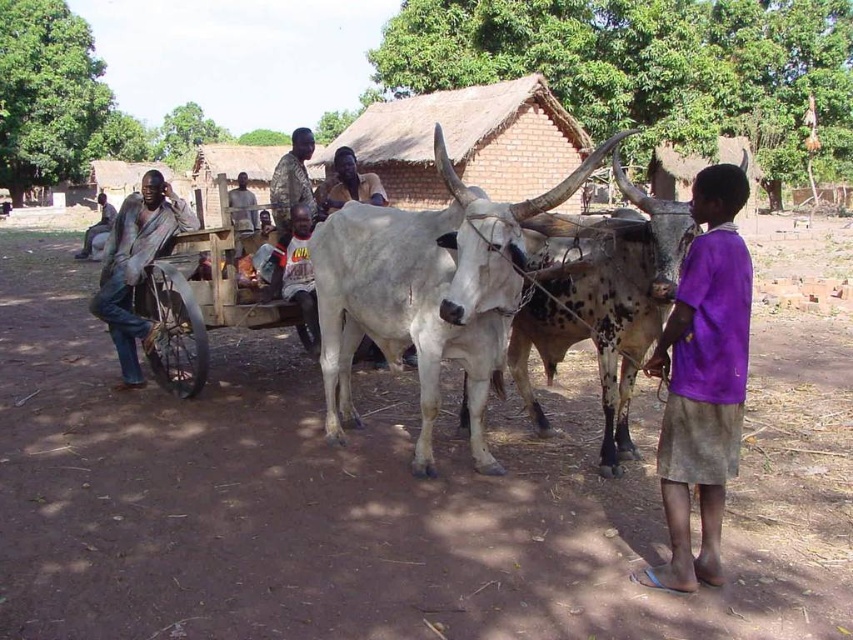
Question: Is blue jeans at left closer to camera compared to dark brown skin at center?

Choices:
 (A) yes
 (B) no

Answer: (A)

Question: Does white matte bull at center have a smaller size compared to blue jeans at left?

Choices:
 (A) no
 (B) yes

Answer: (A)

Question: Among these objects, which one is farthest from the camera?

Choices:
 (A) blue jeans at left
 (B) white matte bull at center
 (C) dark brown skin at center
 (D) purple cotton shirt at center

Answer: (C)

Question: Among these points, which one is nearest to the camera?

Choices:
 (A) (711, 333)
 (B) (167, 205)

Answer: (A)

Question: Which point is closer to the camera taking this photo?

Choices:
 (A) (465, 225)
 (B) (548, 260)

Answer: (A)

Question: Is white matte bull at center thinner than blue jeans at left?

Choices:
 (A) yes
 (B) no

Answer: (B)